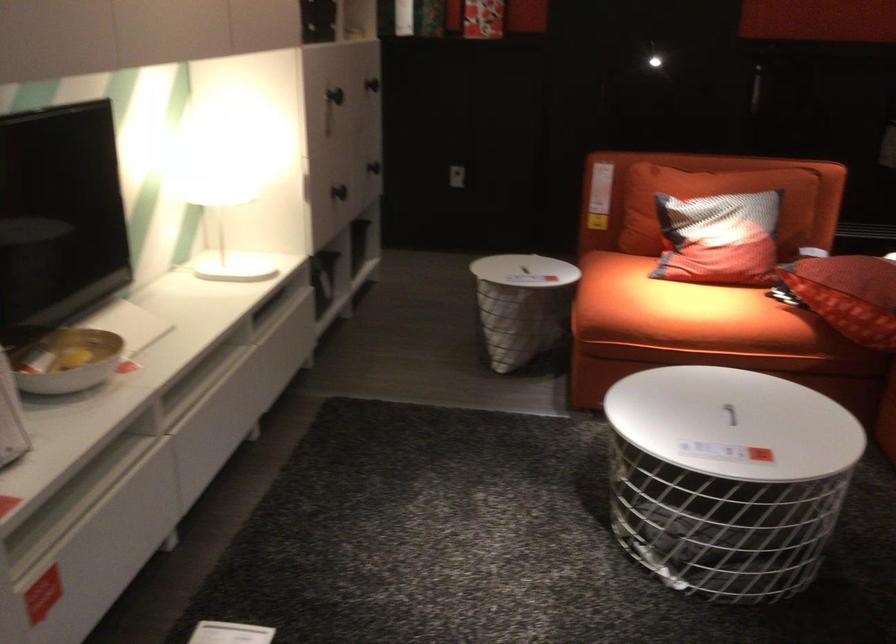
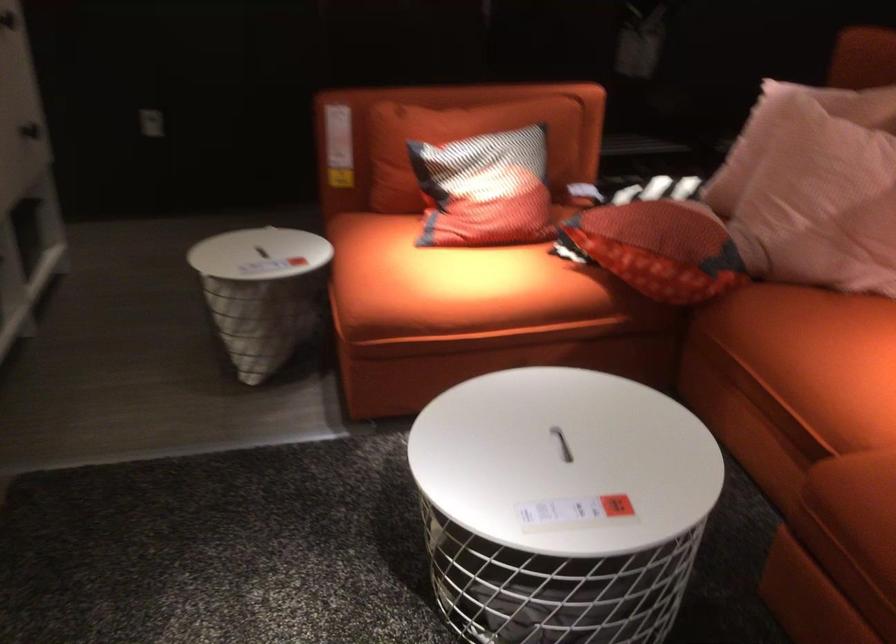
The point at (724, 234) is marked in the first image. Where is the corresponding point in the second image?

(485, 190)